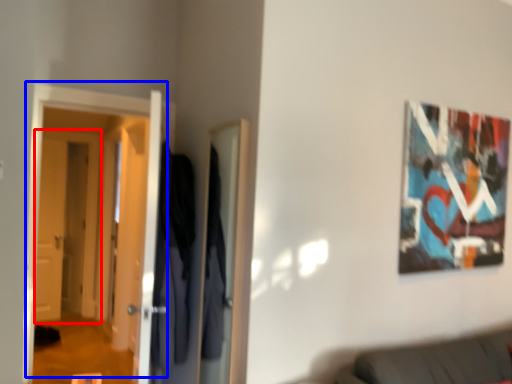
Question: Which object is further to the camera taking this photo, door (highlighted by a red box) or door (highlighted by a blue box)?

Choices:
 (A) door
 (B) door

Answer: (A)